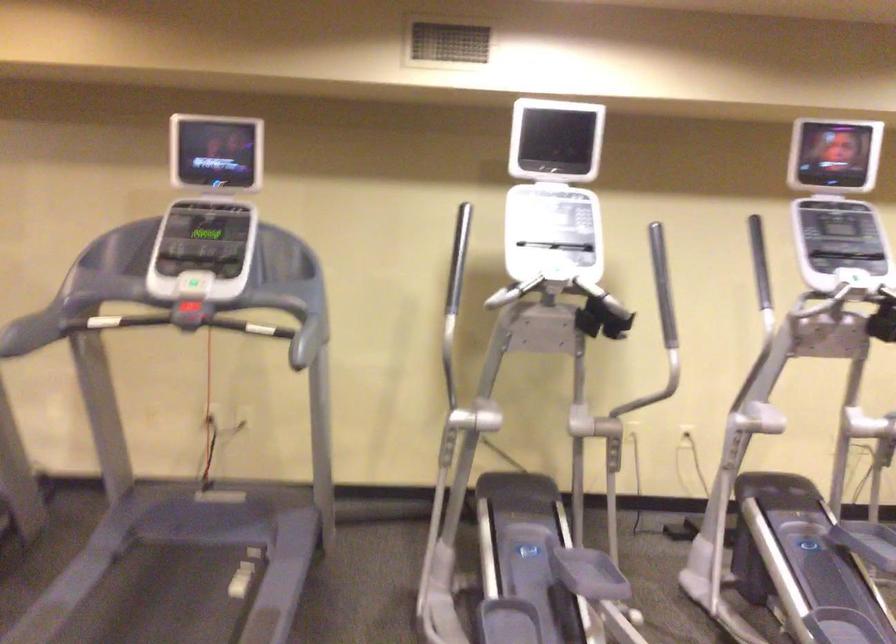
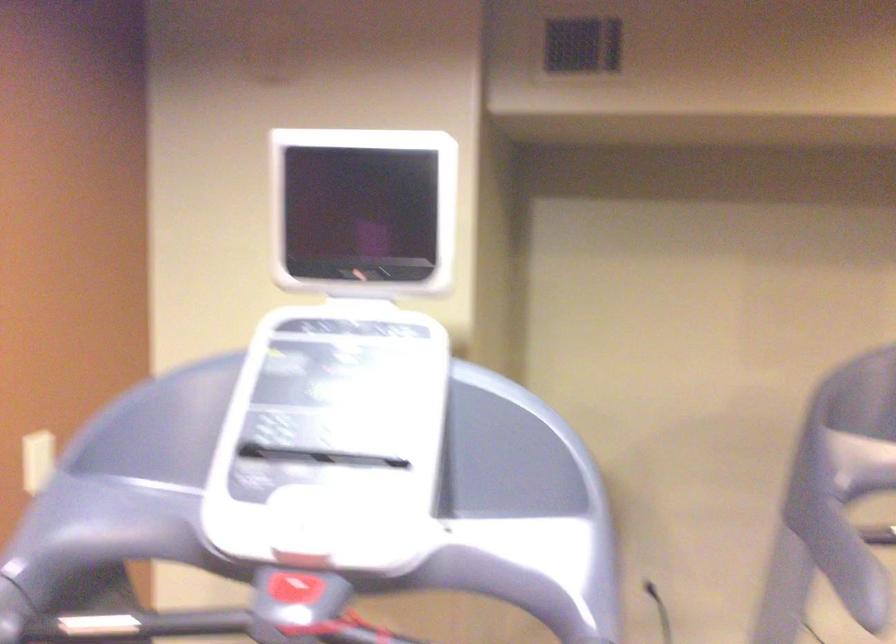
Question: In a continuous first-person perspective shot, in which direction is the camera moving?

Choices:
 (A) Left
 (B) Right
 (C) Forward
 (D) Backward

Answer: (A)